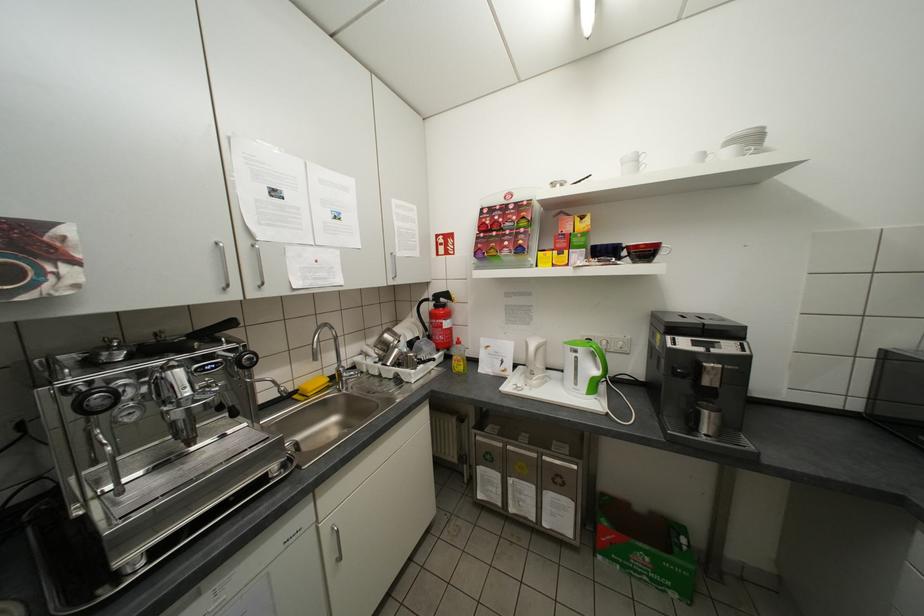
At what (x,y) coordinates should I click in order to perform the action: click on green kettle switch. Please return your answer as a coordinate pair (x, y). Looking at the image, I should click on [x=589, y=367].